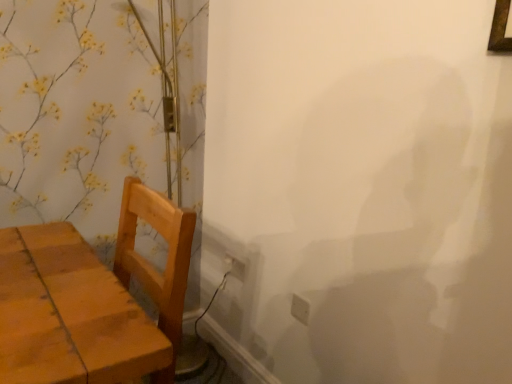
Describe the element at coordinates (300, 309) in the screenshot. I see `white plastic electric outlet at lower right, which is counted as the 1th electric outlet, starting from the right` at that location.

Consider the image. How much space does white plastic electric outlet at lower center, arranged as the first electric outlet when viewed from the left, occupy vertically?

It is 3.63 inches.

What do you see at coordinates (234, 267) in the screenshot?
I see `white plastic electric outlet at lower center, arranged as the 2th electric outlet when ordered from the bottom` at bounding box center [234, 267].

In order to click on wooden table at left in this screenshot , I will do `click(69, 314)`.

Is white plastic electric outlet at lower center, which is the 2th electric outlet in front-to-back order, oriented towards wooden table at left?

Yes, white plastic electric outlet at lower center, which is the 2th electric outlet in front-to-back order, is aimed at wooden table at left.

Is white plastic electric outlet at lower center, which is the 1th electric outlet from top to bottom, next to wooden table at left and touching it?

No, white plastic electric outlet at lower center, which is the 1th electric outlet from top to bottom, is not touching wooden table at left.

From a real-world perspective, does white plastic electric outlet at lower center, arranged as the 2th electric outlet when ordered from the bottom, stand above wooden table at left?

Incorrect, from a real-world perspective, white plastic electric outlet at lower center, arranged as the 2th electric outlet when ordered from the bottom, is lower than wooden table at left.

Considering the positions of objects white plastic electric outlet at lower right, which is counted as the 2th electric outlet, starting from the back, and wooden table at left in the image provided, who is in front, white plastic electric outlet at lower right, which is counted as the 2th electric outlet, starting from the back, or wooden table at left?

wooden table at left is more forward.

Can you confirm if white plastic electric outlet at lower right, which is counted as the 2th electric outlet, starting from the back, is bigger than wooden table at left?

No, white plastic electric outlet at lower right, which is counted as the 2th electric outlet, starting from the back, is not bigger than wooden table at left.

Could you tell me if white plastic electric outlet at lower right, the 1th electric outlet when ordered from bottom to top, is turned towards wooden table at left?

Yes, white plastic electric outlet at lower right, the 1th electric outlet when ordered from bottom to top, is turned towards wooden table at left.

How far apart are wooden table at left and white plastic electric outlet at lower right, which is counted as the 1th electric outlet, starting from the right?

84.04 centimeters.

Which object is more forward, wooden table at left or white plastic electric outlet at lower right, the 2th electric outlet positioned from the top?

wooden table at left.

Is wooden table at left far from white plastic electric outlet at lower right, the 1th electric outlet when ordered from bottom to top?

No, wooden table at left is in close proximity to white plastic electric outlet at lower right, the 1th electric outlet when ordered from bottom to top.

Is white plastic electric outlet at lower right, which is counted as the 1th electric outlet, starting from the right, a part of wooden table at left?

No, white plastic electric outlet at lower right, which is counted as the 1th electric outlet, starting from the right, is not surrounded by wooden table at left.

Which is behind, point (297, 314) or point (230, 257)?

The point (230, 257) is farther.

From the image's perspective, between white plastic electric outlet at lower right, the 2th electric outlet when ordered from left to right, and white plastic electric outlet at lower center, which is the 1th electric outlet from top to bottom, who is located below?

white plastic electric outlet at lower right, the 2th electric outlet when ordered from left to right.

Considering the relative positions of white plastic electric outlet at lower right, the 1th electric outlet when ordered from bottom to top, and white plastic electric outlet at lower center, acting as the 2th electric outlet starting from the right, in the image provided, is white plastic electric outlet at lower right, the 1th electric outlet when ordered from bottom to top, to the right of white plastic electric outlet at lower center, acting as the 2th electric outlet starting from the right, from the viewer's perspective?

Yes, white plastic electric outlet at lower right, the 1th electric outlet when ordered from bottom to top, is to the right of white plastic electric outlet at lower center, acting as the 2th electric outlet starting from the right.

Relative to white plastic electric outlet at lower center, arranged as the 2th electric outlet when ordered from the bottom, is white plastic electric outlet at lower right, the 2th electric outlet positioned from the top, in front or behind?

white plastic electric outlet at lower right, the 2th electric outlet positioned from the top, is positioned closer to the viewer than white plastic electric outlet at lower center, arranged as the 2th electric outlet when ordered from the bottom.

Is white plastic electric outlet at lower center, which is the 2th electric outlet in front-to-back order, aimed at white plastic electric outlet at lower right, arranged as the first electric outlet when viewed from the front?

No, white plastic electric outlet at lower center, which is the 2th electric outlet in front-to-back order, is not aimed at white plastic electric outlet at lower right, arranged as the first electric outlet when viewed from the front.

How distant is white plastic electric outlet at lower center, acting as the 2th electric outlet starting from the right, from white plastic electric outlet at lower right, the 2th electric outlet positioned from the top?

They are 14.34 inches apart.

Consider the image. In terms of size, does white plastic electric outlet at lower center, acting as the 2th electric outlet starting from the right, appear bigger or smaller than white plastic electric outlet at lower right, arranged as the first electric outlet when viewed from the front?

white plastic electric outlet at lower center, acting as the 2th electric outlet starting from the right, is bigger than white plastic electric outlet at lower right, arranged as the first electric outlet when viewed from the front.

Is white plastic electric outlet at lower center, positioned as the 1th electric outlet in back-to-front order, placed right next to white plastic electric outlet at lower right, arranged as the first electric outlet when viewed from the front?

No, white plastic electric outlet at lower center, positioned as the 1th electric outlet in back-to-front order, is not making contact with white plastic electric outlet at lower right, arranged as the first electric outlet when viewed from the front.

Does point (38, 302) come closer to viewer compared to point (242, 265)?

That is True.

Can you confirm if wooden table at left is positioned to the right of white plastic electric outlet at lower center, which is the 2th electric outlet in front-to-back order?

In fact, wooden table at left is to the left of white plastic electric outlet at lower center, which is the 2th electric outlet in front-to-back order.

Is wooden table at left turned away from white plastic electric outlet at lower center, which is the 1th electric outlet from top to bottom?

No, white plastic electric outlet at lower center, which is the 1th electric outlet from top to bottom, is not at the back of wooden table at left.

In the scene shown: Considering the relative sizes of wooden table at left and white plastic electric outlet at lower center, acting as the 2th electric outlet starting from the right, in the image provided, is wooden table at left taller than white plastic electric outlet at lower center, acting as the 2th electric outlet starting from the right,?

Correct, wooden table at left is much taller as white plastic electric outlet at lower center, acting as the 2th electric outlet starting from the right.

Image resolution: width=512 pixels, height=384 pixels. In order to click on electric outlet that is the 2nd one below the wooden table at left (from a real-world perspective) in this screenshot , I will do `click(234, 267)`.

Identify the location of furniture located on the left of white plastic electric outlet at lower right, the 2th electric outlet positioned from the top. (69, 314).

When comparing their distances from white plastic electric outlet at lower right, which is counted as the 1th electric outlet, starting from the right, does white plastic electric outlet at lower center, arranged as the 2th electric outlet when ordered from the bottom, or wooden table at left seem closer?

white plastic electric outlet at lower center, arranged as the 2th electric outlet when ordered from the bottom.

From the image, which object appears to be farther from wooden table at left, white plastic electric outlet at lower right, which is counted as the 1th electric outlet, starting from the right, or white plastic electric outlet at lower center, which is the 2th electric outlet in front-to-back order?

Among the two, white plastic electric outlet at lower center, which is the 2th electric outlet in front-to-back order, is located further to wooden table at left.

From the picture: From the image, which object appears to be nearer to white plastic electric outlet at lower center, which is the 2th electric outlet in front-to-back order, white plastic electric outlet at lower right, arranged as the first electric outlet when viewed from the front, or wooden table at left?

The object closer to white plastic electric outlet at lower center, which is the 2th electric outlet in front-to-back order, is white plastic electric outlet at lower right, arranged as the first electric outlet when viewed from the front.

Looking at the image, which one is located closer to white plastic electric outlet at lower right, arranged as the first electric outlet when viewed from the front, wooden table at left or white plastic electric outlet at lower center, positioned as the 1th electric outlet in back-to-front order?

white plastic electric outlet at lower center, positioned as the 1th electric outlet in back-to-front order, is positioned closer to the anchor white plastic electric outlet at lower right, arranged as the first electric outlet when viewed from the front.

In the scene shown: From the image, which object appears to be nearer to wooden table at left, white plastic electric outlet at lower center, acting as the 2th electric outlet starting from the right, or white plastic electric outlet at lower right, the 2th electric outlet when ordered from left to right?

The object closer to wooden table at left is white plastic electric outlet at lower right, the 2th electric outlet when ordered from left to right.

Considering their positions, is wooden table at left positioned closer to white plastic electric outlet at lower center, which is the 2th electric outlet in front-to-back order, than white plastic electric outlet at lower right, arranged as the first electric outlet when viewed from the front?

The object closer to white plastic electric outlet at lower center, which is the 2th electric outlet in front-to-back order, is white plastic electric outlet at lower right, arranged as the first electric outlet when viewed from the front.

Find the location of `electric outlet between wooden table at left and white plastic electric outlet at lower center, acting as the 2th electric outlet starting from the right, in the front-back direction`. electric outlet between wooden table at left and white plastic electric outlet at lower center, acting as the 2th electric outlet starting from the right, in the front-back direction is located at coordinates (300, 309).